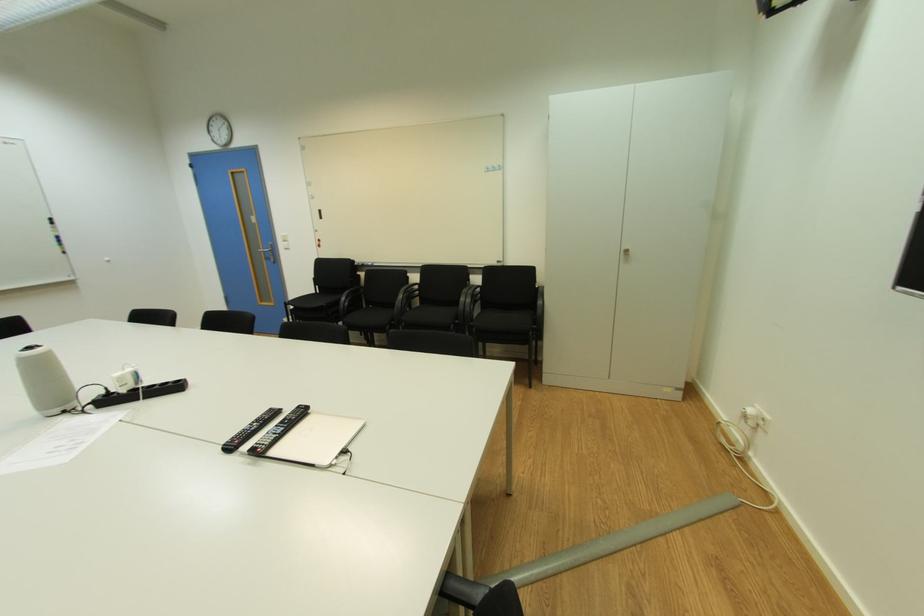
I want to click on metal door handle, so click(268, 253).